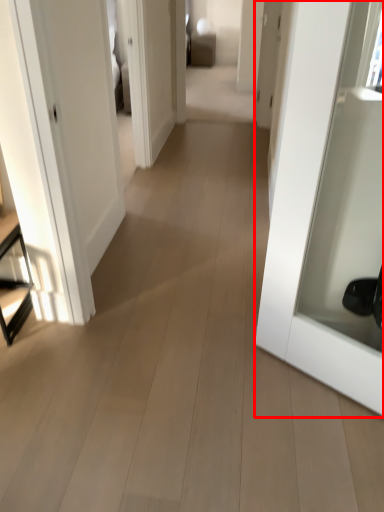
Question: From the image's perspective, considering the relative positions of door (annotated by the red box) and furniture in the image provided, where is door (annotated by the red box) located with respect to the staircase?

Choices:
 (A) above
 (B) below

Answer: (A)